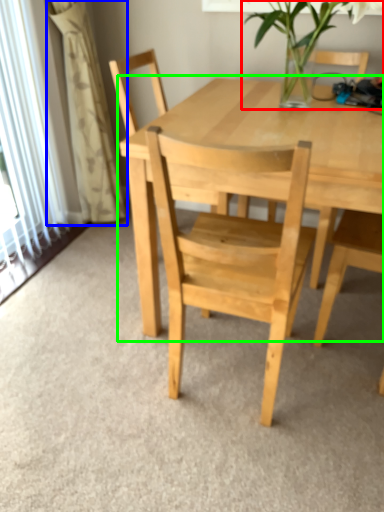
Question: Considering the real-world distances, which object is farthest from houseplant (highlighted by a red box)? curtain (highlighted by a blue box) or round table (highlighted by a green box)?

Choices:
 (A) curtain
 (B) round table

Answer: (A)